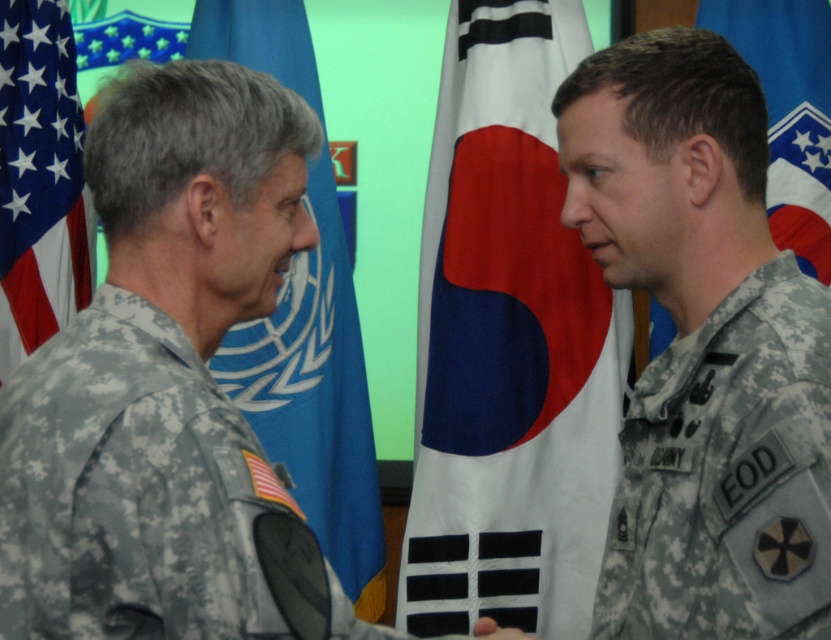
Between point (318, 337) and point (0, 209), which one is positioned behind?

Positioned behind is point (318, 337).

Is point (353, 609) positioned before point (35, 49)?

No, it is not.

What do you see at coordinates (316, 397) in the screenshot? I see `blue fabric flag at left` at bounding box center [316, 397].

The height and width of the screenshot is (640, 831). In order to click on blue fabric flag at left in this screenshot , I will do `click(316, 397)`.

Which is more to the right, blue fabric flag at right or smooth skin hand at center?

blue fabric flag at right

Can you confirm if blue fabric flag at right is thinner than smooth skin hand at center?

No.

The width and height of the screenshot is (831, 640). What are the coordinates of `blue fabric flag at right` in the screenshot? It's located at (789, 113).

Can you confirm if camouflage fabric uniform at right is positioned above blue fabric flag at left?

No.

Based on the photo, does camouflage fabric uniform at right appear on the right side of blue fabric flag at left?

Indeed, camouflage fabric uniform at right is positioned on the right side of blue fabric flag at left.

Is point (657, 579) more distant than point (327, 515)?

That is False.

The image size is (831, 640). What are the coordinates of `camouflage fabric uniform at right` in the screenshot? It's located at (726, 474).